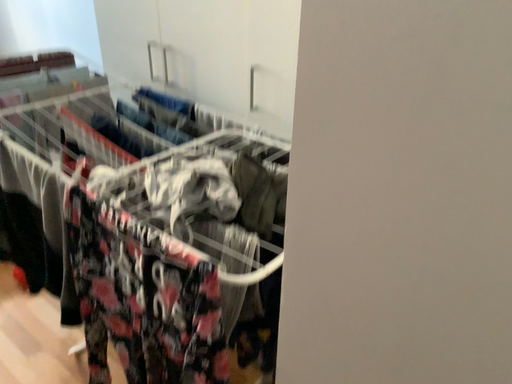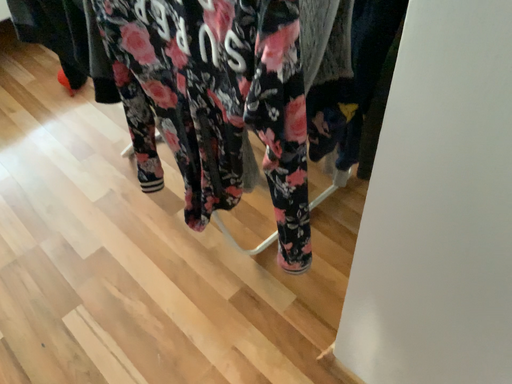
Question: Which way did the camera rotate in the video?

Choices:
 (A) rotated right
 (B) rotated left

Answer: (B)